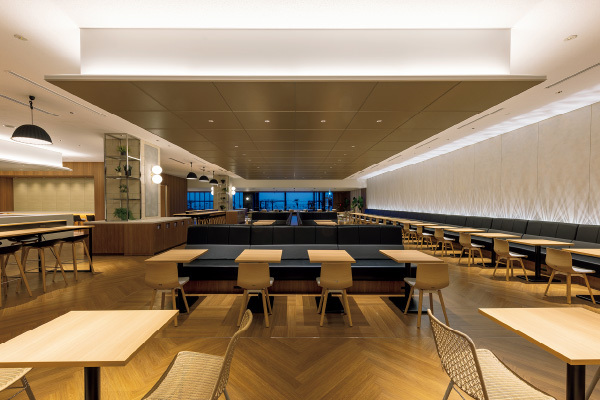
At what (x,y) coordinates should I click in order to perform the action: click on hanging ceiling lights. Please return your answer as a coordinate pair (x, y). Looking at the image, I should click on point(29,130), point(190,175), point(201,179), point(211,181).